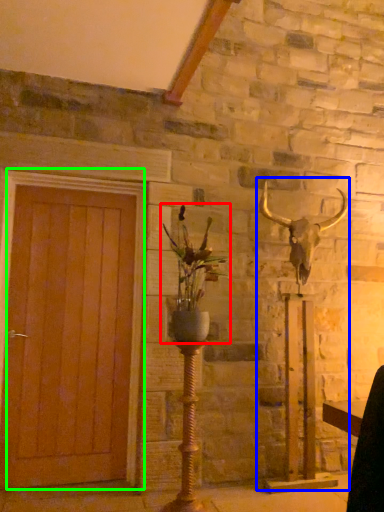
Question: Which object is the farthest from houseplant (highlighted by a red box)? Choose among these: sculpture (highlighted by a blue box) or door (highlighted by a green box).

Choices:
 (A) sculpture
 (B) door

Answer: (A)